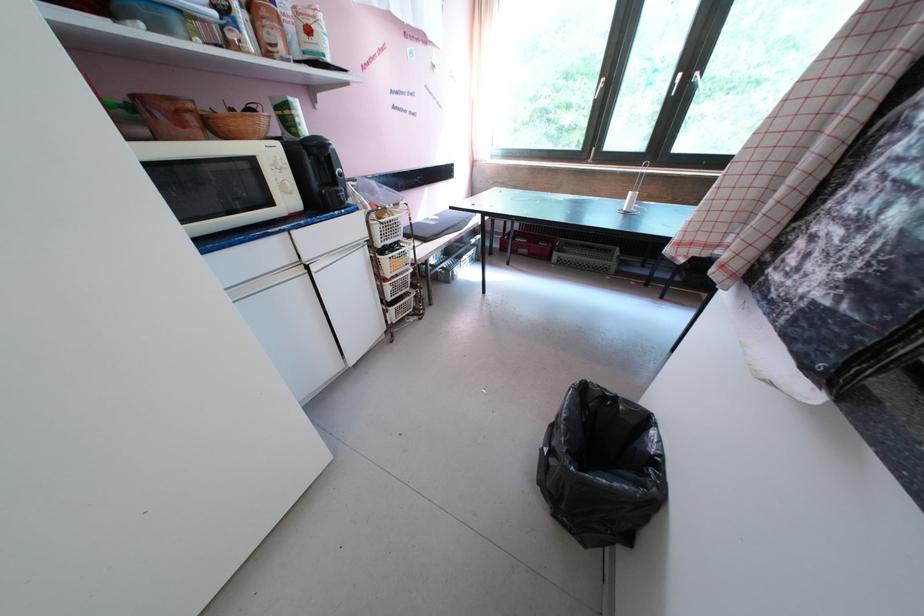
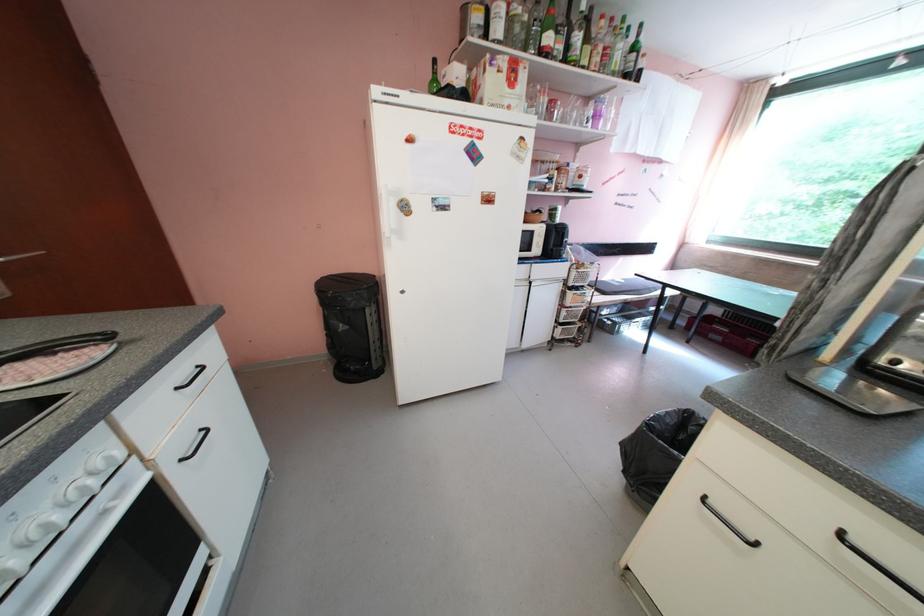
The point at (385, 253) is marked in the first image. Where is the corresponding point in the second image?

(576, 290)